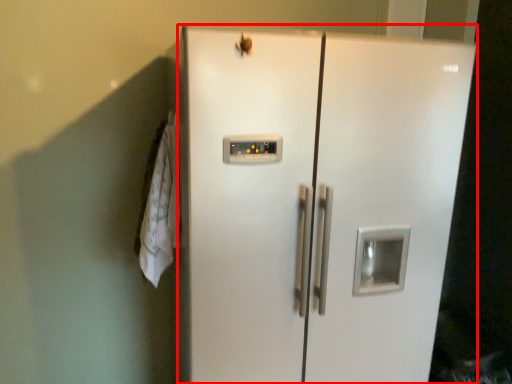
Question: From the image, what is the correct spatial relationship of refrigerator (annotated by the red box) in relation to laundry?

Choices:
 (A) left
 (B) right

Answer: (B)